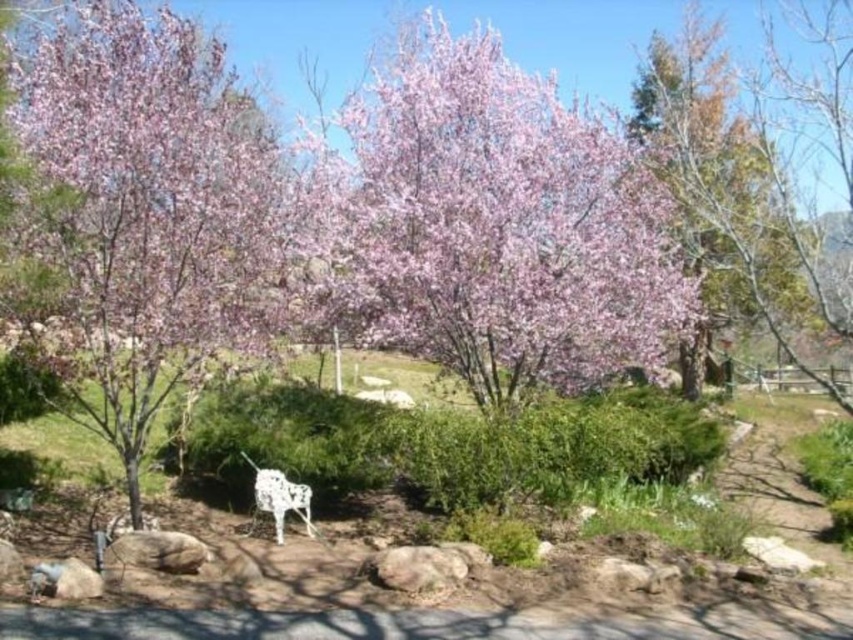
Is pink matte flower at upper center above white metallic chair at center?

Yes, pink matte flower at upper center is above white metallic chair at center.

How far apart are pink matte flower at upper center and white metallic chair at center?

They are 2.23 meters apart.

Between point (387, 275) and point (271, 472), which one is positioned in front?

Positioned in front is point (387, 275).

Locate an element on the screen. Image resolution: width=853 pixels, height=640 pixels. pink matte flower at upper center is located at coordinates (502, 225).

Can you confirm if white metallic horse at center is thinner than white metallic chair at center?

No.

Who is more forward, (x=782, y=426) or (x=281, y=515)?

Point (x=281, y=515)

What do you see at coordinates (314, 486) in the screenshot?
I see `white metallic horse at center` at bounding box center [314, 486].

At what (x,y) coordinates should I click in order to perform the action: click on white metallic horse at center. Please return your answer as a coordinate pair (x, y). The width and height of the screenshot is (853, 640). Looking at the image, I should click on (314, 486).

Between white metallic horse at center and pink blossoming tree at upper right, which one is positioned lower?

Positioned lower is white metallic horse at center.

Who is shorter, white metallic horse at center or pink blossoming tree at upper right?

white metallic horse at center is shorter.

Locate an element on the screen. white metallic horse at center is located at coordinates tap(314, 486).